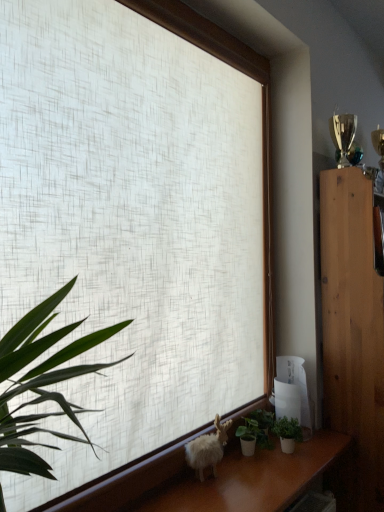
Question: From a real-world perspective, is white textured fabric at center physically located above or below wooden cabinet at right?

Choices:
 (A) above
 (B) below

Answer: (A)

Question: From their relative heights in the image, would you say white textured fabric at center is taller or shorter than wooden cabinet at right?

Choices:
 (A) tall
 (B) short

Answer: (B)

Question: Considering the real-world distances, which object is farthest from the green matte plant at lower right, which is the first houseplant from right to left?

Choices:
 (A) green matte houseplant at lower center, which is counted as the second houseplant, starting from the right
 (B) white fluffy goat at lower center
 (C) white textured fabric at center
 (D) wooden cabinet at right

Answer: (C)

Question: Estimate the real-world distances between objects in this image. Which object is farther from the green matte houseplant at lower center, marked as the first houseplant in a left-to-right arrangement?

Choices:
 (A) green matte plant at lower right, which is the first houseplant from right to left
 (B) white textured fabric at center
 (C) white fluffy goat at lower center
 (D) wooden cabinet at right

Answer: (B)